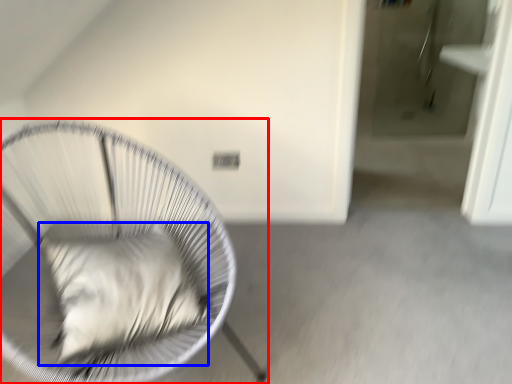
Question: Which object appears farthest to the camera in this image, furniture (highlighted by a red box) or pillow (highlighted by a blue box)?

Choices:
 (A) furniture
 (B) pillow

Answer: (B)